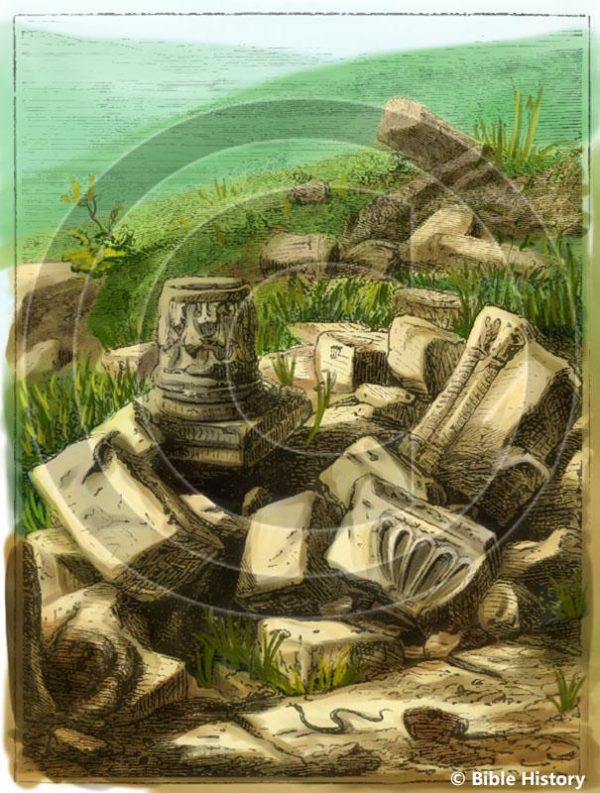
In order to click on picture in this screenshot , I will do `click(465, 669)`.